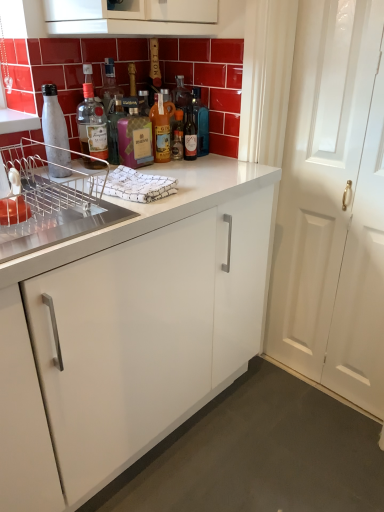
Find the location of a particular element. The width and height of the screenshot is (384, 512). vacant space situated on the left part of white matte water bottle at left, which is the 6th bottle from right to left is located at coordinates (35, 176).